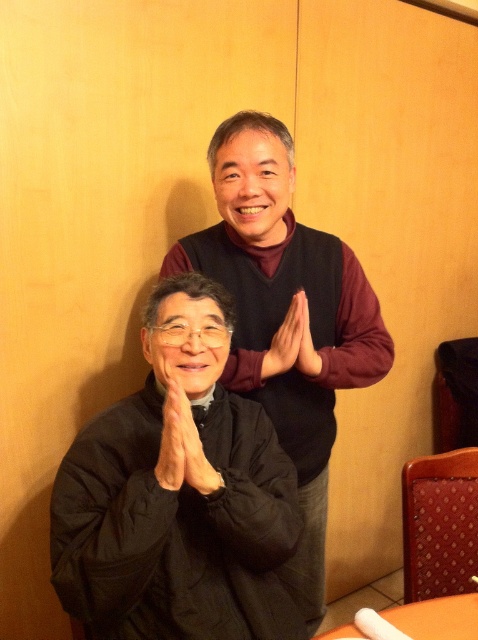
You are a server in a restaurant and you need to place a tray on the orange plastic table at lower right. However, you notice that the matte black hands at center are currently resting there. Can you easily slide the tray onto the table without moving the hands?

The orange plastic table at lower right is not as tall as matte black hands at center, so the hands are higher than the table. This means the hands are likely above the table surface, so you can slide the tray underneath them easily.

You are a photographer setting up for a group photo in the described scene. You need to place a small prop exactly at the point where the black matte robe at lower left is located. According to the coordinates provided, where should you position the prop?

The black matte robe at lower left is located at point coordinates (175, 528), so you should position the prop at those coordinates.

You are standing in a casual dining area and want to take a photo of the point at coordinates (152, 440). The camera you are using has a minimum focus distance of 4 feet. Will the camera be able to focus on the point?

The point at coordinates (152, 440) is 3.72 feet from the camera, which is within the camera minimum focus distance of 4 feet. Therefore, the camera will be able to focus on the point.